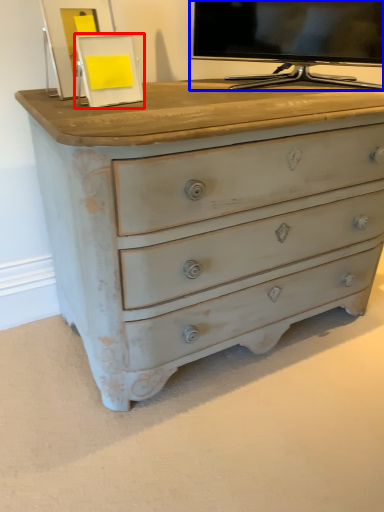
Question: Among these objects, which one is nearest to the camera, picture frame (highlighted by a red box) or television (highlighted by a blue box)?

Choices:
 (A) picture frame
 (B) television

Answer: (A)